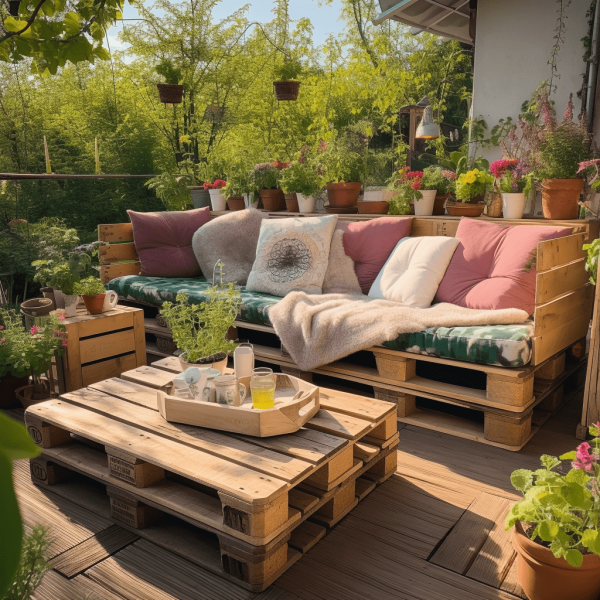
Find the location of `white mug`. white mug is located at coordinates (107, 305).